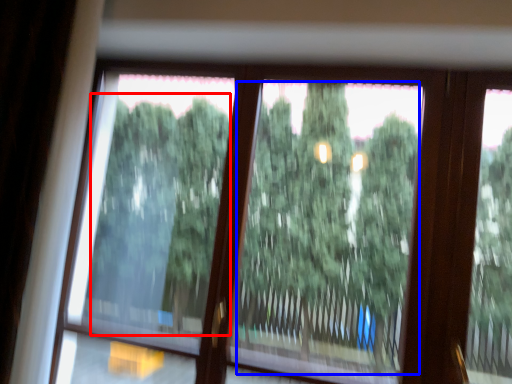
Question: Which of the following is the closest to the observer, tree (highlighted by a red box) or tree (highlighted by a blue box)?

Choices:
 (A) tree
 (B) tree

Answer: (B)